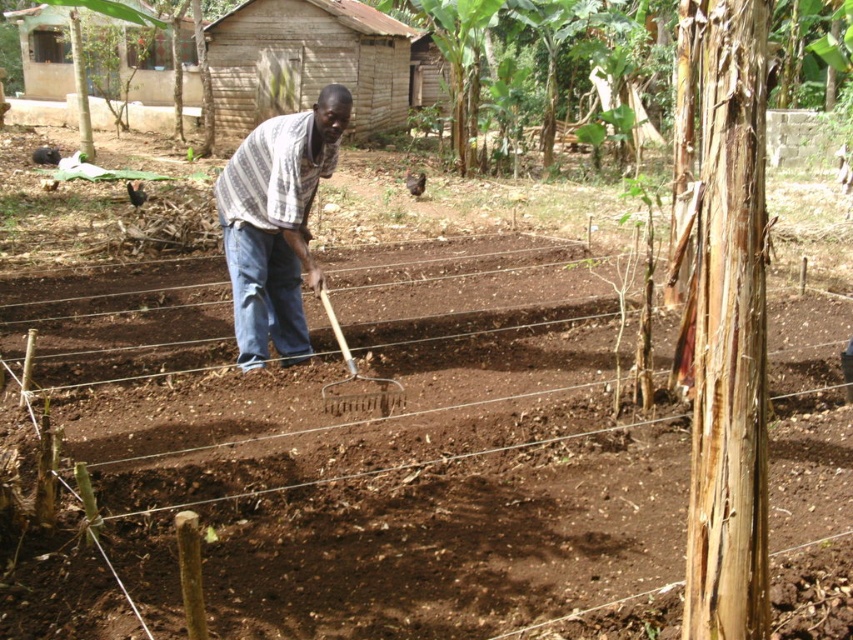
Question: Is striped fabric shirt at center below wooden rake at center?

Choices:
 (A) no
 (B) yes

Answer: (A)

Question: Among these points, which one is farthest from the camera?

Choices:
 (A) (258, 204)
 (B) (343, 355)

Answer: (A)

Question: Is striped fabric shirt at center positioned in front of wooden rake at center?

Choices:
 (A) yes
 (B) no

Answer: (B)

Question: Is striped fabric shirt at center smaller than wooden rake at center?

Choices:
 (A) no
 (B) yes

Answer: (A)